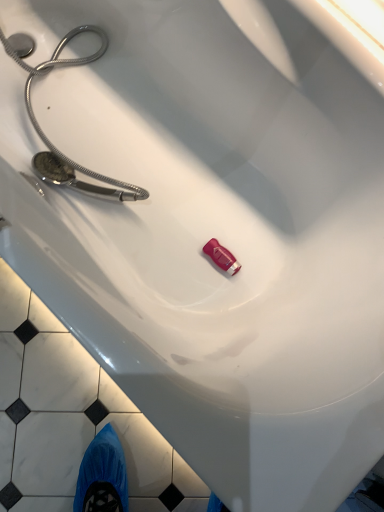
Measure the distance between pink glossy soap at center and camera.

pink glossy soap at center and camera are 1.02 meters apart from each other.

Describe the element at coordinates (221, 257) in the screenshot. I see `pink glossy soap at center` at that location.

This screenshot has width=384, height=512. What are the coordinates of `pink glossy soap at center` in the screenshot? It's located at (221, 257).

The height and width of the screenshot is (512, 384). Find the location of `pink glossy soap at center`. pink glossy soap at center is located at coordinates pyautogui.click(x=221, y=257).